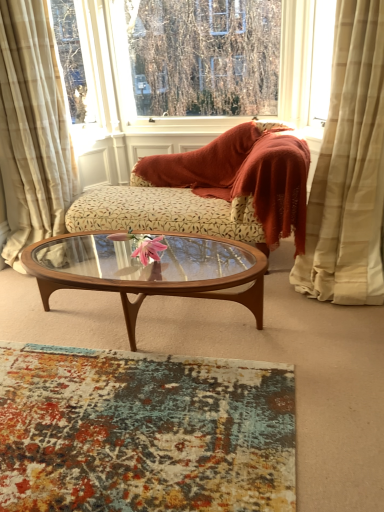
Question: Is transparent glass window at upper center oriented towards floral-patterned fabric couch at center?

Choices:
 (A) no
 (B) yes

Answer: (A)

Question: From a real-world perspective, does transparent glass window at upper center sit lower than floral-patterned fabric couch at center?

Choices:
 (A) no
 (B) yes

Answer: (A)

Question: Does transparent glass window at upper center have a larger size compared to floral-patterned fabric couch at center?

Choices:
 (A) no
 (B) yes

Answer: (A)

Question: Can you confirm if transparent glass window at upper center is positioned to the left of floral-patterned fabric couch at center?

Choices:
 (A) no
 (B) yes

Answer: (B)

Question: Is floral-patterned fabric couch at center at the back of transparent glass window at upper center?

Choices:
 (A) yes
 (B) no

Answer: (B)

Question: Is transparent glass window at upper center next to floral-patterned fabric couch at center?

Choices:
 (A) yes
 (B) no

Answer: (B)

Question: From a real-world perspective, is beige plaid curtain at left, the second curtain viewed from the right, located higher than beige textured curtain at right, arranged as the 2th curtain when viewed from the left?

Choices:
 (A) yes
 (B) no

Answer: (B)

Question: Is beige plaid curtain at left, the 1th curtain positioned from the left, thinner than beige textured curtain at right, which is the 1th curtain in right-to-left order?

Choices:
 (A) yes
 (B) no

Answer: (B)

Question: Is beige plaid curtain at left, the 1th curtain positioned from the left, outside of beige textured curtain at right, which is the 1th curtain in right-to-left order?

Choices:
 (A) no
 (B) yes

Answer: (B)

Question: From the image's perspective, does beige plaid curtain at left, the second curtain viewed from the right, appear higher than beige textured curtain at right, which is the 1th curtain in right-to-left order?

Choices:
 (A) yes
 (B) no

Answer: (A)

Question: Considering the relative sizes of beige plaid curtain at left, the 1th curtain positioned from the left, and beige textured curtain at right, which is the 1th curtain in right-to-left order, in the image provided, is beige plaid curtain at left, the 1th curtain positioned from the left, wider than beige textured curtain at right, which is the 1th curtain in right-to-left order,?

Choices:
 (A) no
 (B) yes

Answer: (B)

Question: From a real-world perspective, is beige plaid curtain at left, the second curtain viewed from the right, physically below beige textured curtain at right, which is the 1th curtain in right-to-left order?

Choices:
 (A) no
 (B) yes

Answer: (B)

Question: Can you confirm if beige textured curtain at right, arranged as the 2th curtain when viewed from the left, is positioned to the right of beige plaid curtain at left, the 1th curtain positioned from the left?

Choices:
 (A) no
 (B) yes

Answer: (B)